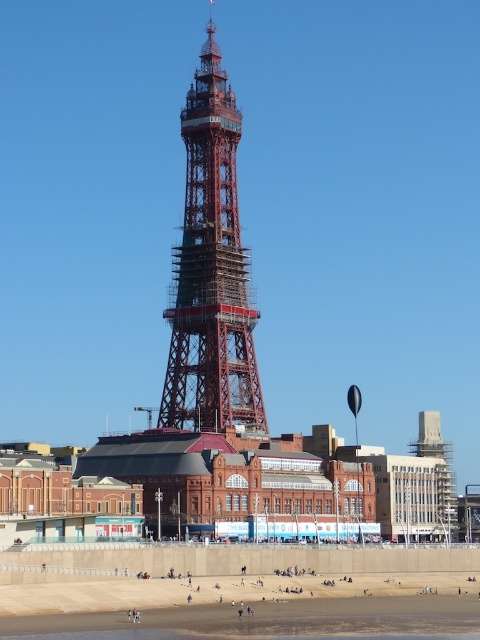
You are a photographer standing on the sandy beach at lower center, wanting to take a photo of the red metal eiffel tower at center. Can you see the entire tower in your viewfinder without moving your position? Explain why based on their positions.

The red metal eiffel tower at center is above the sandy beach at lower center, so yes, you can see the entire tower in your viewfinder from that position because the tower is elevated and positioned above the beach.

You are a tourist standing on the sandy beach at lower center, looking at the red metal eiffel tower at center. Which object is bigger in the image?

The red metal eiffel tower at center is larger in size compared to the sandy beach at lower center according to the description.

You are standing on the sandy beach at lower center and want to walk directly towards the red metal eiffel tower at center. Is the tower in front of or behind you relative to your current position?

The red metal eiffel tower at center is further to the viewer than the sandy beach at lower center, so the tower is in front of you relative to your current position on the sandy beach at lower center.